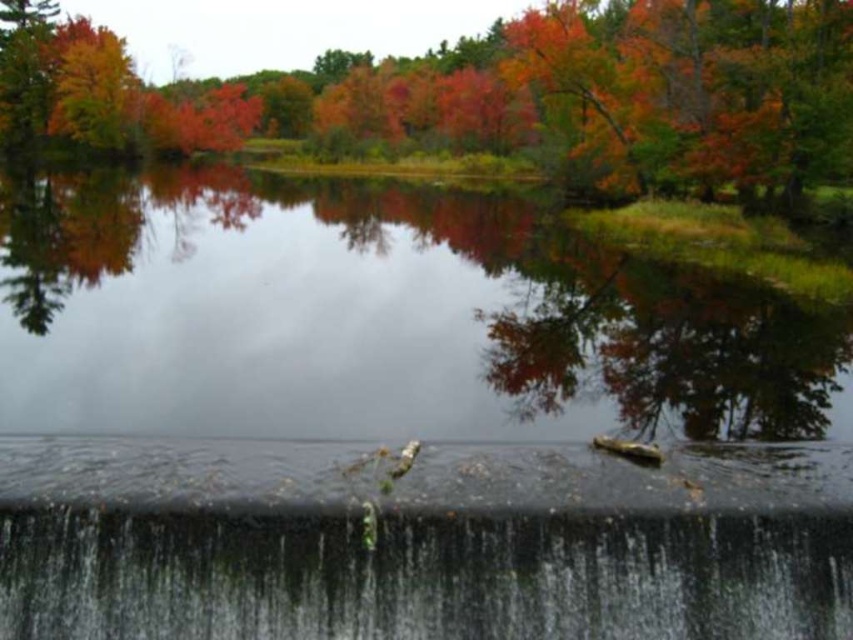
Is autumn leaves at upper center positioned in front of green mossy concrete waterfall at lower center?

No, autumn leaves at upper center is behind green mossy concrete waterfall at lower center.

Can you confirm if autumn leaves at upper center is thinner than green mossy concrete waterfall at lower center?

Incorrect, autumn leaves at upper center's width is not less than green mossy concrete waterfall at lower center's.

Image resolution: width=853 pixels, height=640 pixels. I want to click on autumn leaves at upper center, so click(x=503, y=97).

Locate an element on the screen. Image resolution: width=853 pixels, height=640 pixels. autumn leaves at upper center is located at coordinates [x=503, y=97].